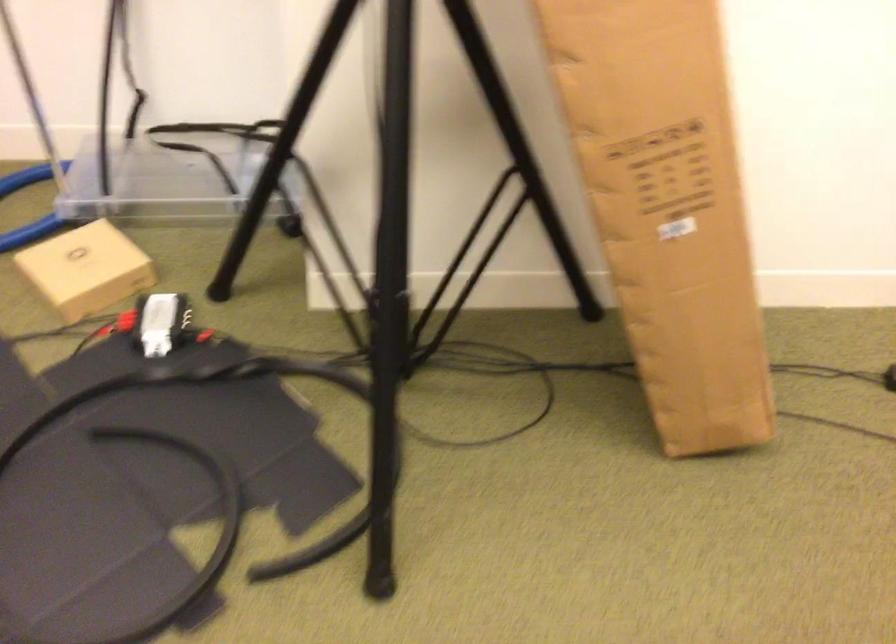
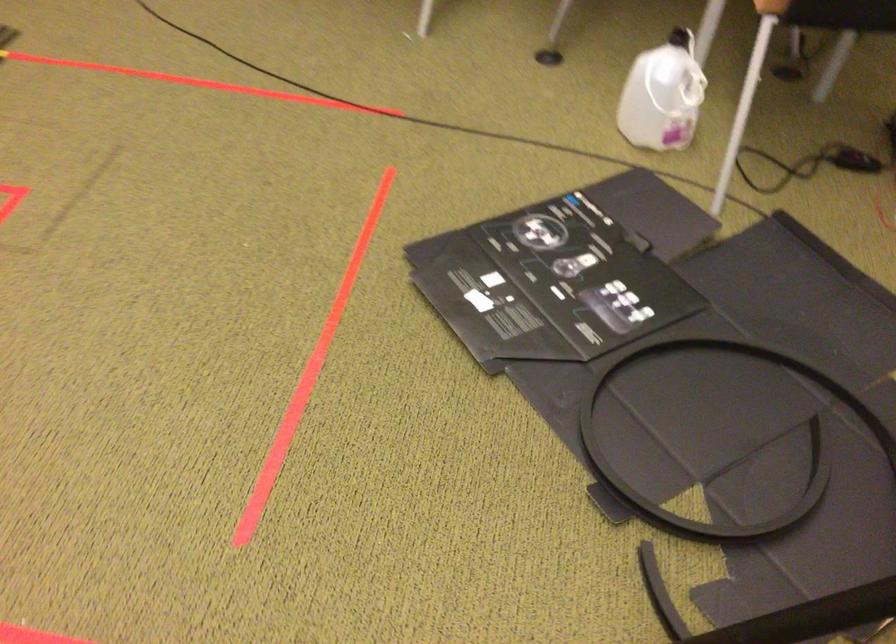
How did the camera likely rotate?

The rotation direction of the camera is left-down.